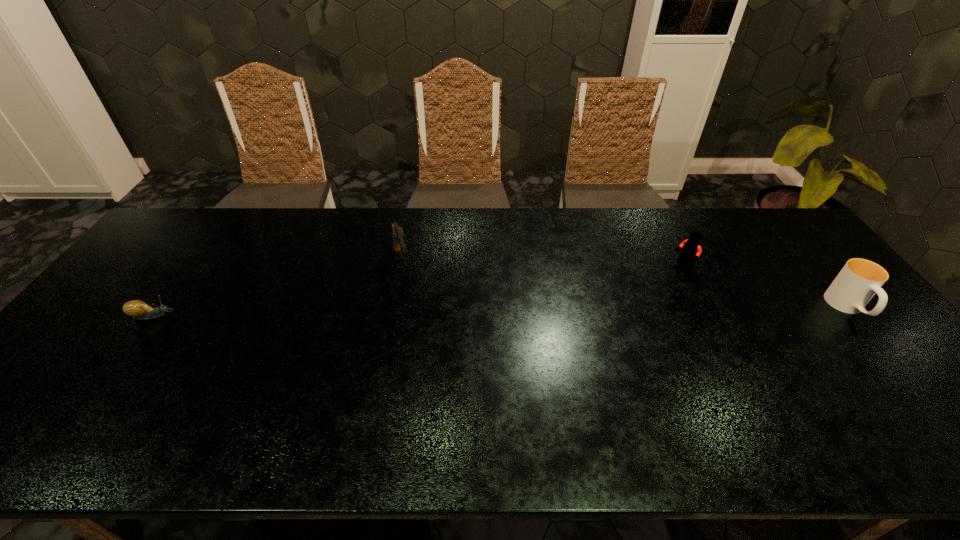
Identify the location of vacant space on the desktop that is between the escargot and the rightmost object and is positioned on the front-facing side of the third object from left to right. Image resolution: width=960 pixels, height=540 pixels. (606, 311).

The height and width of the screenshot is (540, 960). I want to click on free spot on the desktop that is between the shortest object and the cup and is positioned along the barrel of the gun, so click(x=420, y=313).